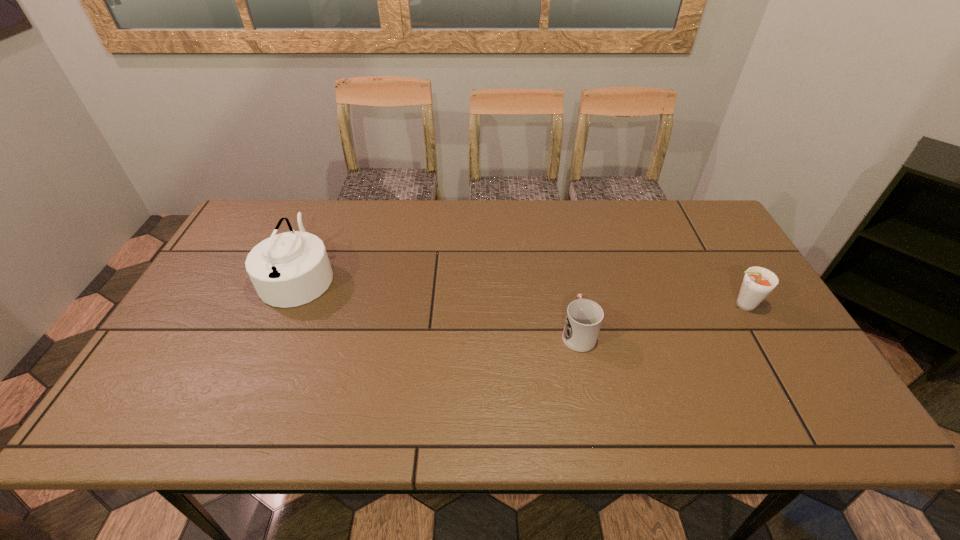
This screenshot has height=540, width=960. I want to click on kettle, so click(x=290, y=269).

Where is `the tallest object`? Image resolution: width=960 pixels, height=540 pixels. the tallest object is located at coordinates (290, 269).

Where is `the rightmost object`? the rightmost object is located at coordinates (758, 282).

This screenshot has width=960, height=540. In order to click on the second shortest object in this screenshot , I will do `click(758, 282)`.

Locate an element on the screen. Image resolution: width=960 pixels, height=540 pixels. the second object from left to right is located at coordinates (583, 320).

Where is `cup`? cup is located at coordinates (583, 320).

Where is `vacant space located on the spout of the tallest object`? The image size is (960, 540). vacant space located on the spout of the tallest object is located at coordinates pyautogui.click(x=408, y=275).

At what (x,y) coordinates should I click in order to perform the action: click on vacant space situated 0.180m on the drink side of the second shortest object. Please return your answer as a coordinate pair (x, y). This screenshot has width=960, height=540. Looking at the image, I should click on (656, 305).

The width and height of the screenshot is (960, 540). I want to click on vacant space located on the drink side of the second shortest object, so pyautogui.click(x=588, y=305).

Locate an element on the screen. blank space located 0.320m on the drink side of the second shortest object is located at coordinates (603, 305).